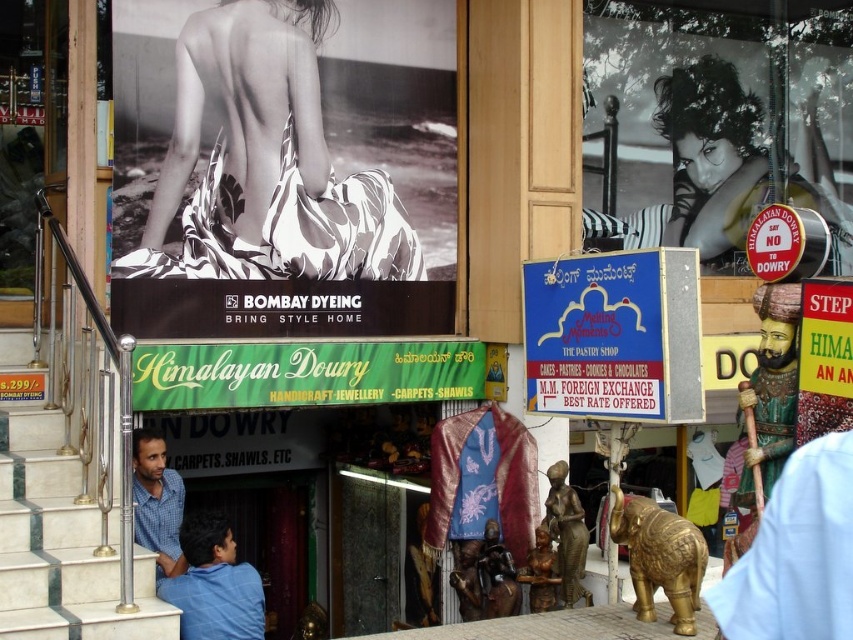
You are a delivery person carrying a package that is 30 inches long. You need to navigate between the white marble stairs at lower left and the blue checkered shirt at lower left. Can you fit the package through the space between them?

The white marble stairs at lower left and blue checkered shirt at lower left are 31.27 inches apart from each other. Since the package is 30 inches long, it can fit through the space between them as the distance is slightly larger than the package length.

Looking at this image, you are a customer standing at the entrance of the shop and see the white marble stairs at lower left and the blue checkered shirt at lower left. Which object is bigger?

The white marble stairs at lower left is larger in size than the blue checkered shirt at lower left.

You are a delivery person carrying a large package that requires 2 meters of space to maneuver. You need to move from the blue shirt at lower left to the green fabric signboard at center. Is there enough space between them to move your package?

The distance between the blue shirt at lower left and the green fabric signboard at center is 1.83 meters. Since your package needs 2 meters of space, there isn